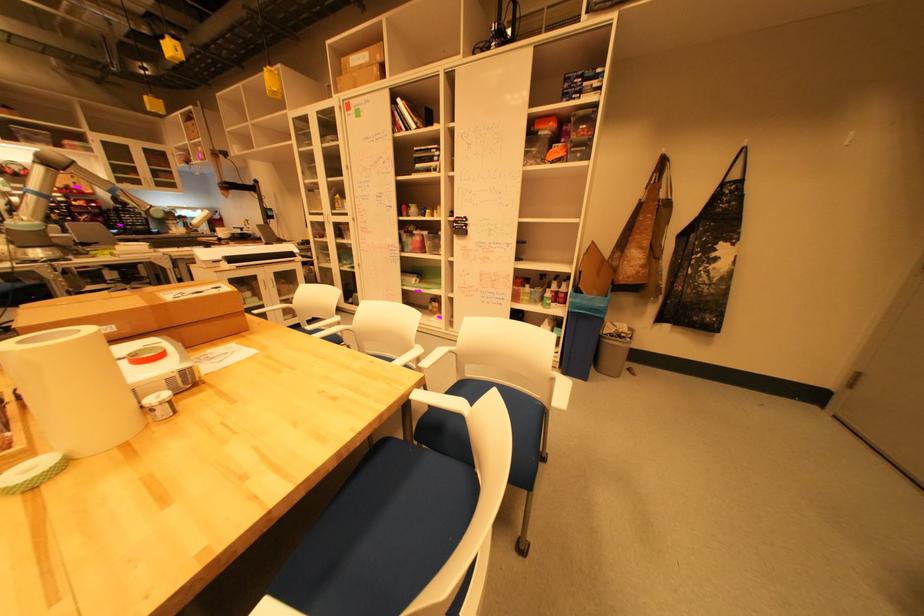
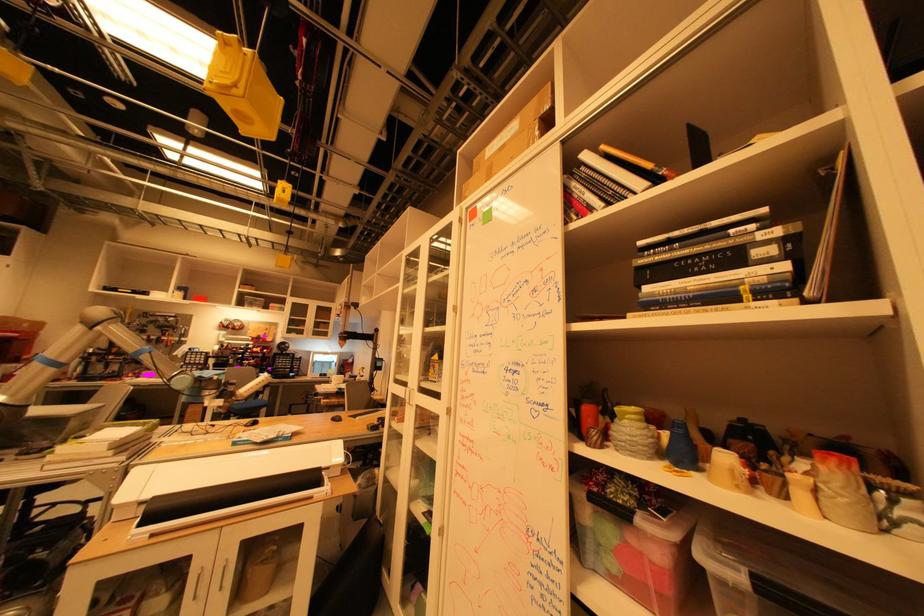
Locate, in the second image, the point that corresponds to (x=411, y=102) in the first image.

(598, 156)